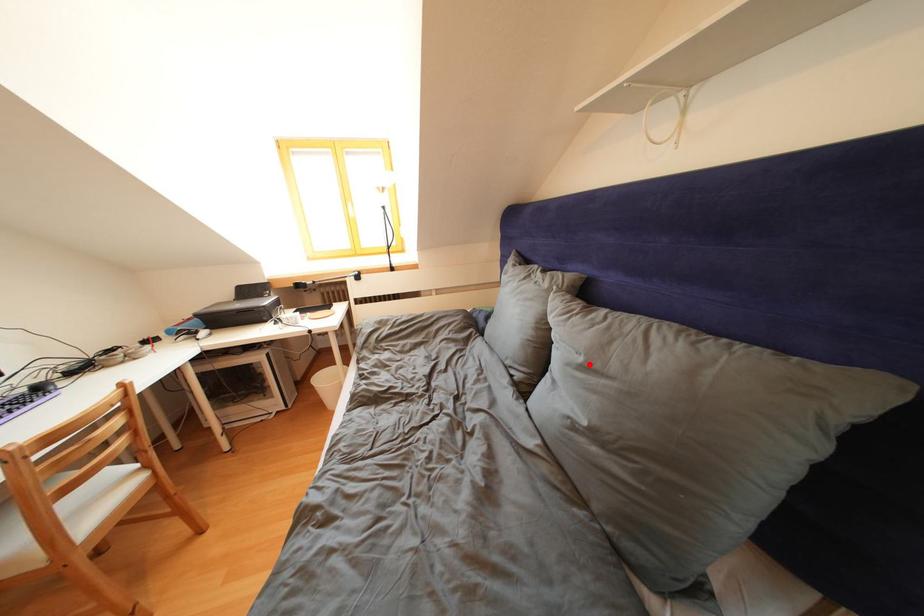
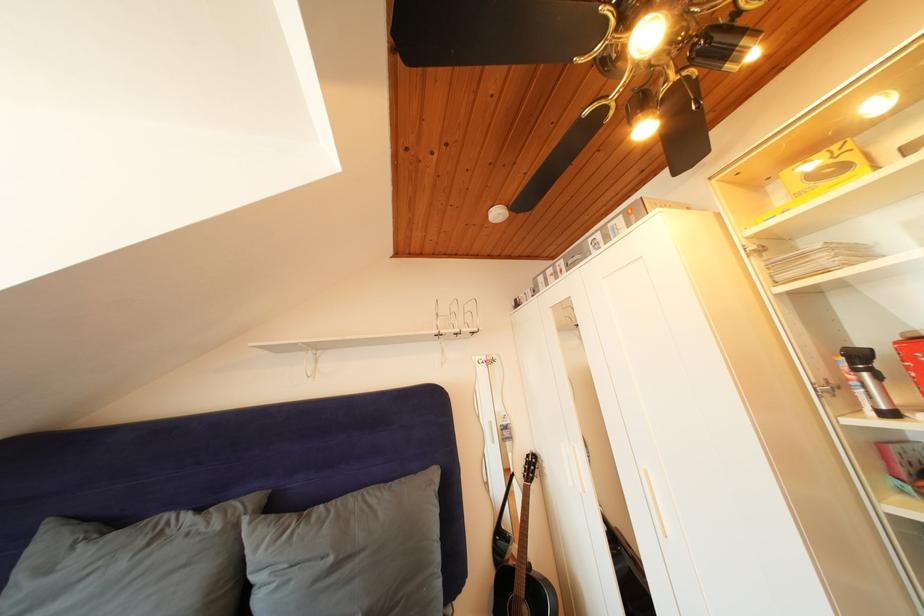
Find the pixel in the second image that matches the highlighted location in the first image.

(338, 565)